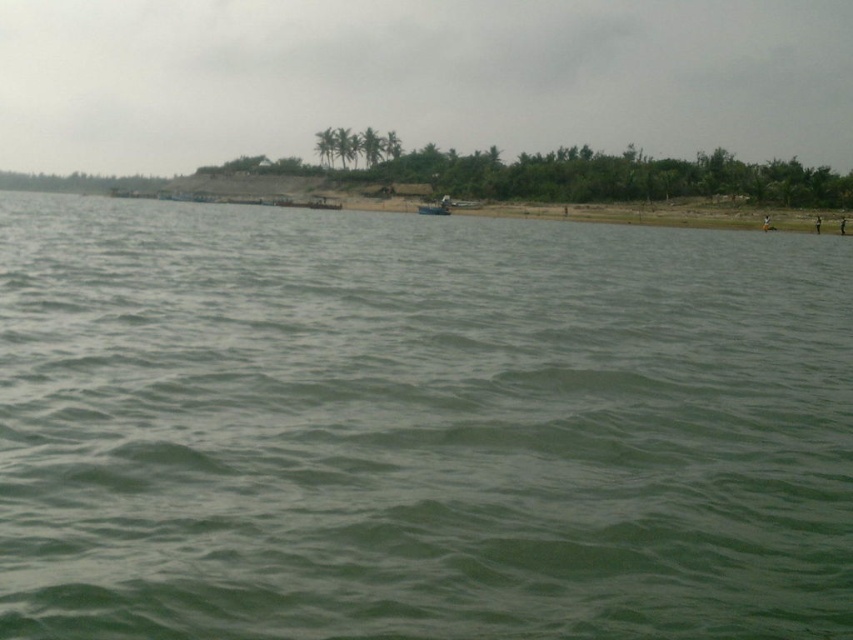
Question: Is green water at center wider than green grassy hill at upper center?

Choices:
 (A) no
 (B) yes

Answer: (A)

Question: Which of the following is the farthest from the observer?

Choices:
 (A) green water at center
 (B) metallic gray boat at center

Answer: (B)

Question: Estimate the real-world distances between objects in this image. Which object is closer to the metallic gray boat at center?

Choices:
 (A) green grassy hill at upper center
 (B) green water at center

Answer: (B)

Question: In this image, where is green grassy hill at upper center located relative to metallic gray boat at center?

Choices:
 (A) above
 (B) below

Answer: (A)

Question: Which point is closer to the camera taking this photo?

Choices:
 (A) (445, 195)
 (B) (447, 17)

Answer: (A)

Question: Does green grassy hill at upper center come in front of metallic gray boat at center?

Choices:
 (A) yes
 (B) no

Answer: (B)